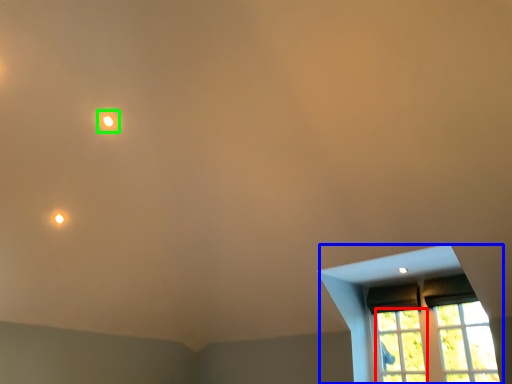
Question: Which object is positioned farthest from glass window (highlighted by a red box)? Select from window (highlighted by a blue box) and light (highlighted by a green box).

Choices:
 (A) window
 (B) light

Answer: (B)